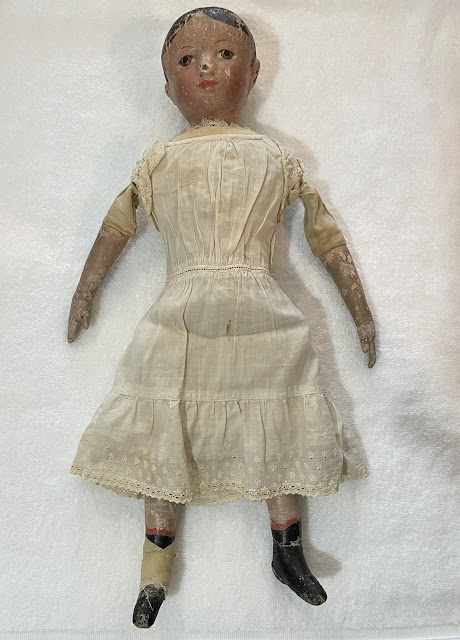
Identify the location of doll arm. (101, 269), (352, 272).